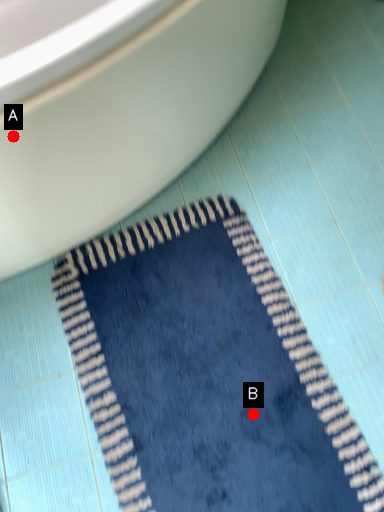
Question: Two points are circled on the image, labeled by A and B beside each circle. Which point is farther to the camera?

Choices:
 (A) A is further
 (B) B is further

Answer: (B)